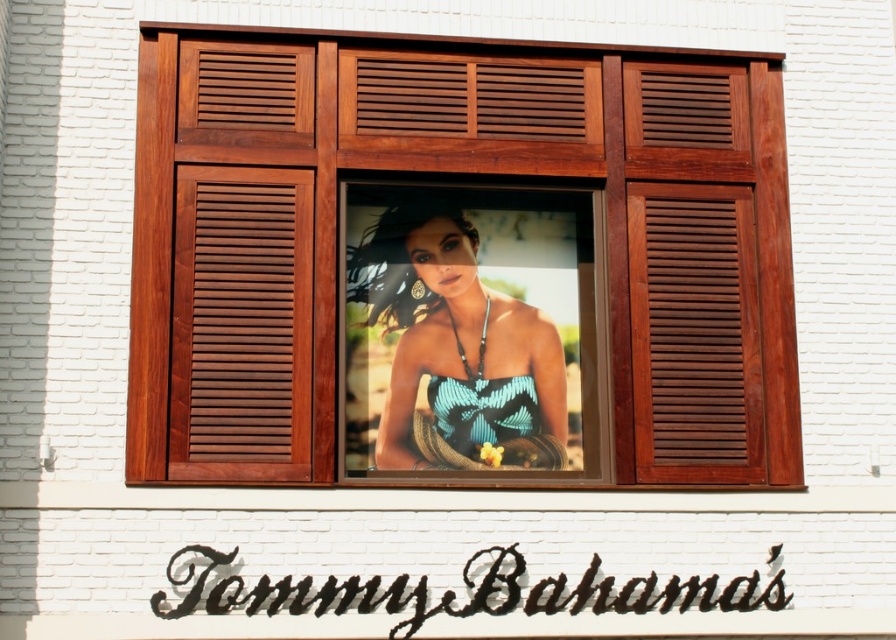
Who is positioned more to the right, matte blue fabric at center or blue woven fabric dress at center?

blue woven fabric dress at center is more to the right.

Does point (386, 305) lie behind point (450, 442)?

Yes, it is behind point (450, 442).

Who is more distant from viewer, (455, 323) or (480, 376)?

Point (455, 323)

The height and width of the screenshot is (640, 896). In order to click on matte blue fabric at center in this screenshot , I will do `click(457, 349)`.

Which is above, mahogany wood shutter at right or blue woven fabric dress at center?

mahogany wood shutter at right

Is point (737, 412) behind point (461, 406)?

That is False.

This screenshot has height=640, width=896. What are the coordinates of `mahogany wood shutter at right` in the screenshot? It's located at (694, 332).

Image resolution: width=896 pixels, height=640 pixels. Identify the location of matte blue fabric at center. (457, 349).

Between matte blue fabric at center and brown wooden shutter at left, which one appears on the left side from the viewer's perspective?

brown wooden shutter at left

The image size is (896, 640). What are the coordinates of `matte blue fabric at center` in the screenshot? It's located at (457, 349).

This screenshot has width=896, height=640. Find the location of `matte blue fabric at center`. matte blue fabric at center is located at coordinates (457, 349).